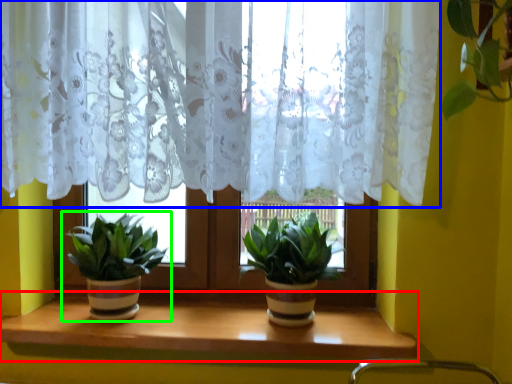
Question: Which is farther away from window sill (highlighted by a red box)? curtain (highlighted by a blue box) or houseplant (highlighted by a green box)?

Choices:
 (A) curtain
 (B) houseplant

Answer: (A)